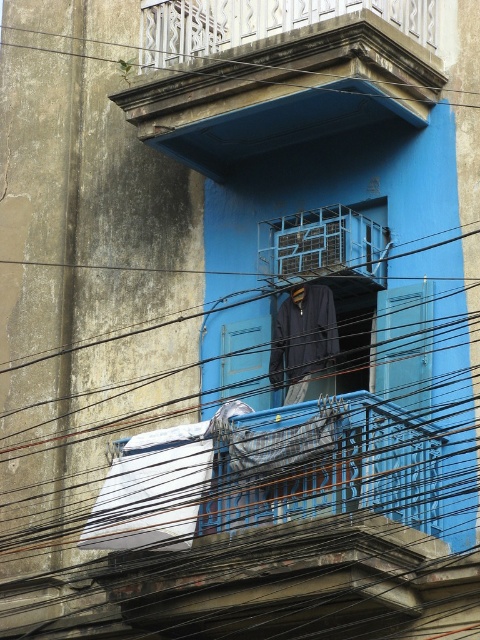
You are an architect inspecting the building. You notice the blue metal railing at upper center and the black wire at upper center. Which one is smaller in size?

The blue metal railing at upper center is smaller in size compared to the black wire at upper center.